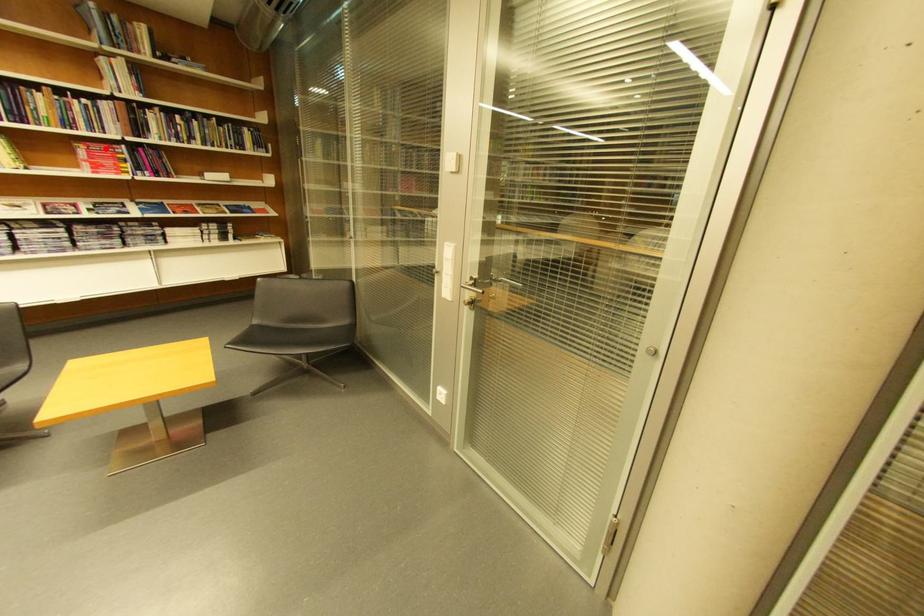
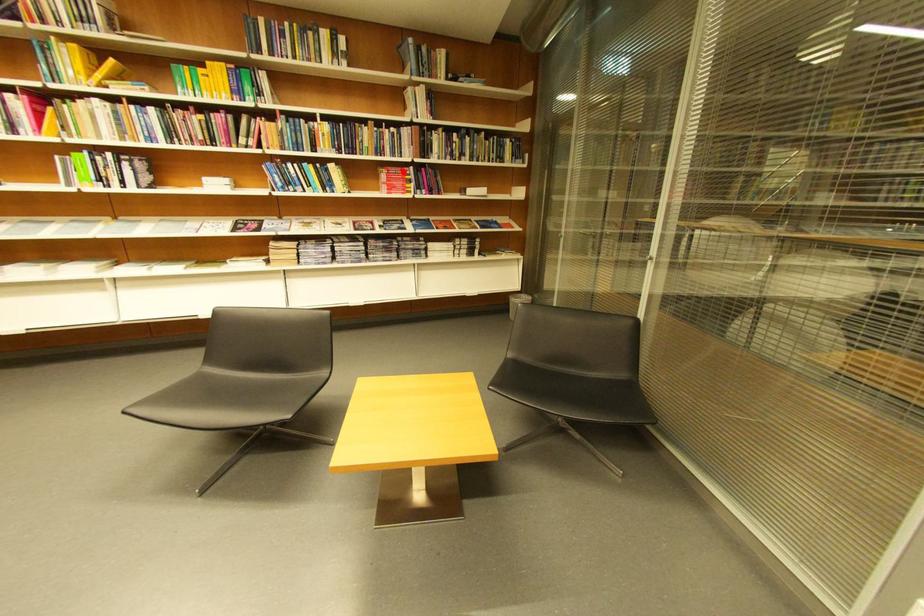
I am providing you with two images of the same scene from different viewpoints. A red point is marked on the first image and another point is marked on the second image. Is the red point in image1 aligned with the point shown in image2?

Yes